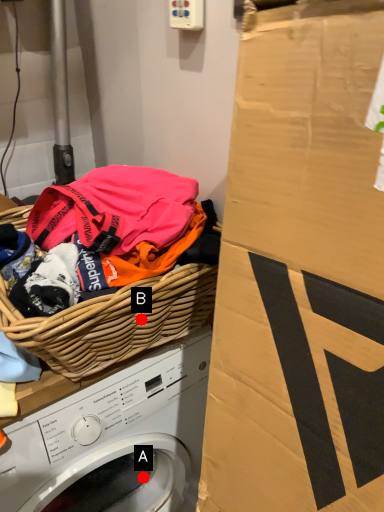
Question: Two points are circled on the image, labeled by A and B beside each circle. Which point is closer to the camera?

Choices:
 (A) A is closer
 (B) B is closer

Answer: (B)